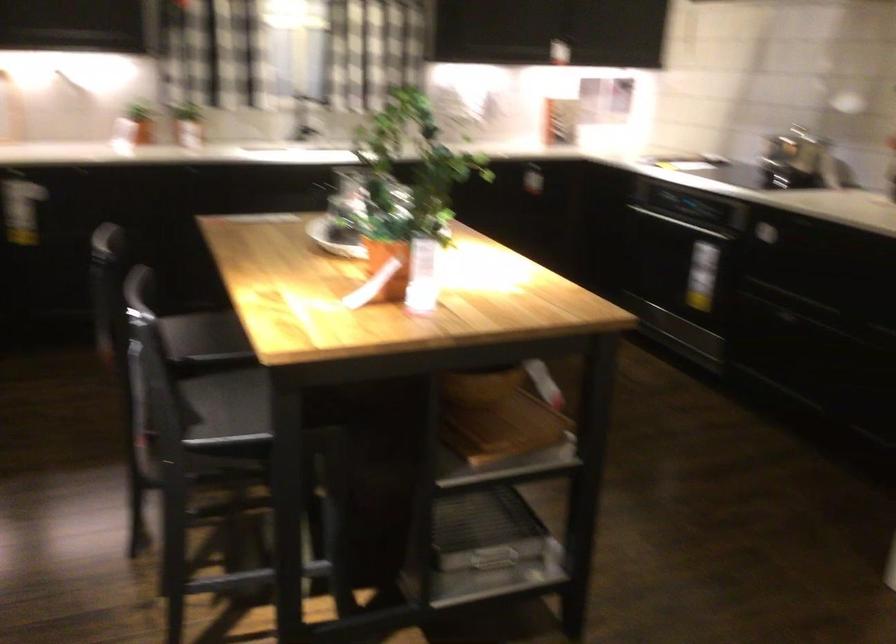
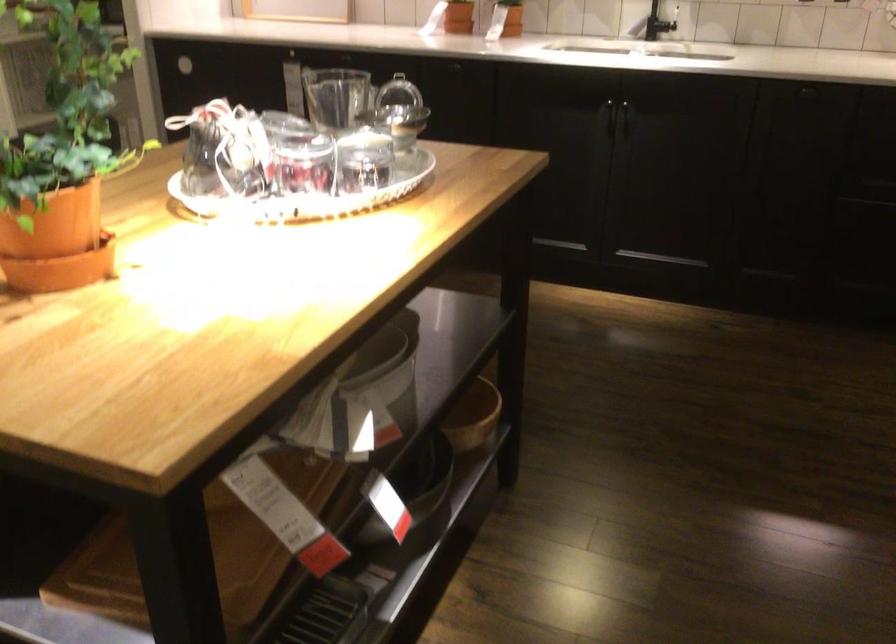
In the second image, find the point that corresponds to point (565, 310) in the first image.

(135, 406)